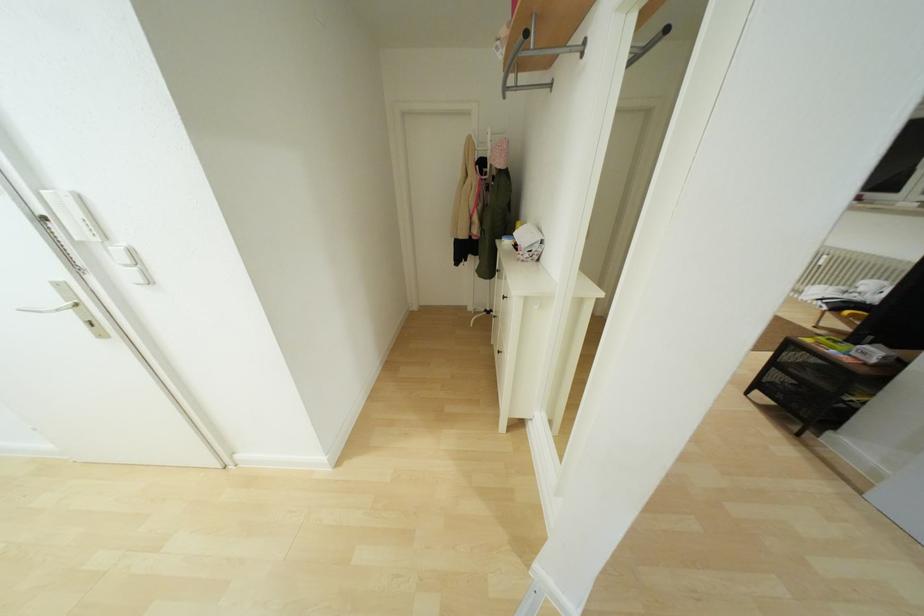
What do you see at coordinates (513, 63) in the screenshot? I see `the metal coat hook` at bounding box center [513, 63].